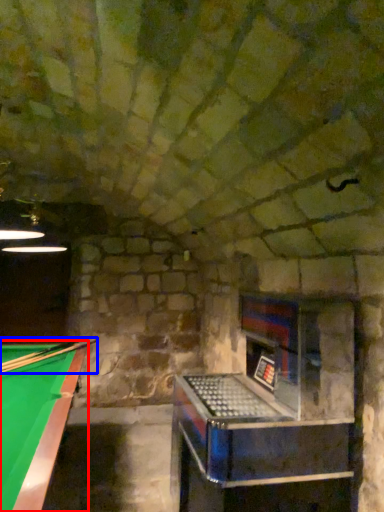
Question: Which object is further to the camera taking this photo, billiard table (highlighted by a red box) or cue (highlighted by a blue box)?

Choices:
 (A) billiard table
 (B) cue

Answer: (B)